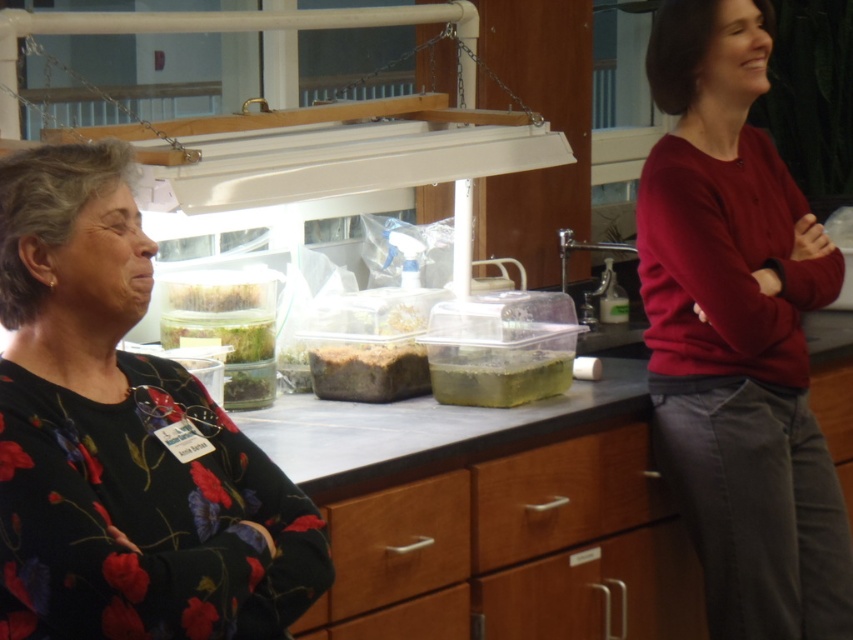
Can you confirm if floral print blouse at center is bigger than matte red sweater at right?

Incorrect, floral print blouse at center is not larger than matte red sweater at right.

Looking at this image, who is more forward, (238, 484) or (709, 376)?

Point (238, 484) is in front.

The image size is (853, 640). I want to click on floral print blouse at center, so click(123, 440).

Is matte red sweater at right taller than brown matte soil at center?

Correct, matte red sweater at right is much taller as brown matte soil at center.

Does matte red sweater at right have a lesser height compared to brown matte soil at center?

No, matte red sweater at right is not shorter than brown matte soil at center.

This screenshot has width=853, height=640. Find the location of `matte red sweater at right`. matte red sweater at right is located at coordinates (737, 333).

Is translucent plastic container at center above brown matte soil at center?

Incorrect, translucent plastic container at center is not positioned above brown matte soil at center.

Measure the distance between translucent plastic container at center and brown matte soil at center.

The distance of translucent plastic container at center from brown matte soil at center is 8.82 inches.

Find the location of a particular element. translucent plastic container at center is located at coordinates (496, 374).